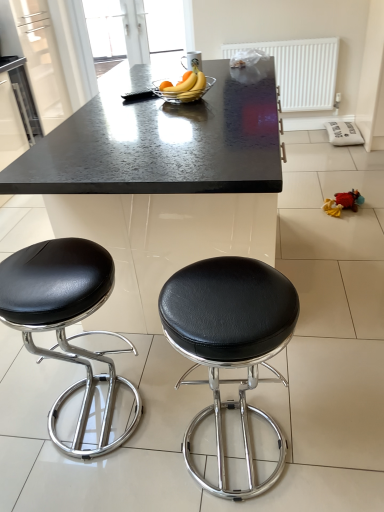
Question: Considering their positions, is black leather stool at left, which is the first stool from left to right, located in front of or behind white textured radiator at upper center?

Choices:
 (A) front
 (B) behind

Answer: (A)

Question: In terms of height, does black leather stool at left, the 2th stool positioned from the right, look taller or shorter compared to white textured radiator at upper center?

Choices:
 (A) short
 (B) tall

Answer: (B)

Question: Which is nearer to the yellow matte banana at center?

Choices:
 (A) clear glass bowl at center
 (B) black granite table at center
 (C) black leather stool at center, the second stool when ordered from left to right
 (D) black leather stool at left, which is the first stool from left to right
 (E) white textured radiator at upper center

Answer: (A)

Question: Which object is the closest to the red plush toy at lower right?

Choices:
 (A) clear glass bowl at center
 (B) black granite table at center
 (C) black leather stool at left, which is the first stool from left to right
 (D) black leather stool at center, placed as the first stool when sorted from right to left
 (E) white textured radiator at upper center

Answer: (A)